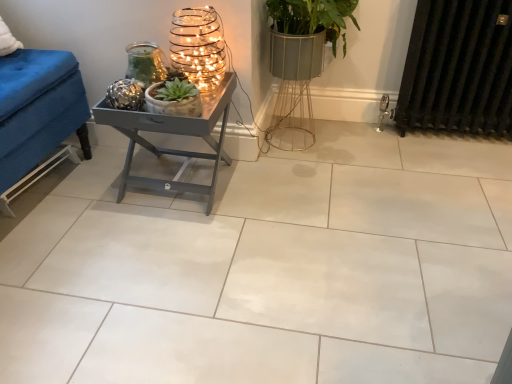
Question: Is black metal radiator at right taller or shorter than white glossy tile at center?

Choices:
 (A) short
 (B) tall

Answer: (B)

Question: From a real-world perspective, is black metal radiator at right positioned above or below white glossy tile at center?

Choices:
 (A) above
 (B) below

Answer: (A)

Question: Which object is the farthest from the metallic wire candle holder at upper left, arranged as the 2th candle holder when viewed from the left?

Choices:
 (A) metallic textured candle holder at upper center, marked as the first candle holder in a left-to-right arrangement
 (B) green matte succulent at center
 (C) black metal radiator at right
 (D) metallic gray table at center
 (E) white glossy tile at center

Answer: (C)

Question: Which is nearer to the white glossy tile at center?

Choices:
 (A) green matte succulent at center
 (B) black metal radiator at right
 (C) metallic gray table at center
 (D) metallic wire candle holder at upper left, arranged as the 2th candle holder when viewed from the left
 (E) metallic textured candle holder at upper center, marked as the first candle holder in a left-to-right arrangement

Answer: (C)